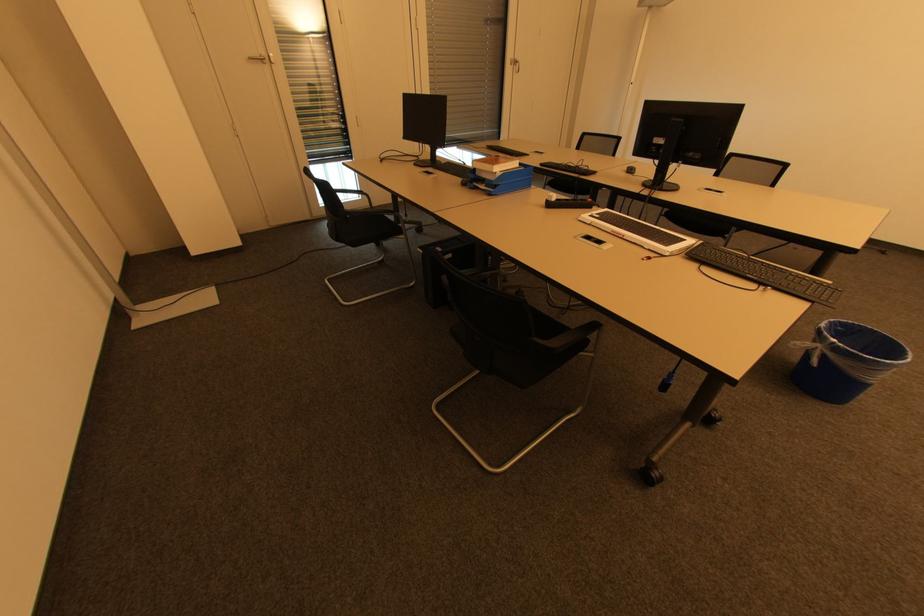
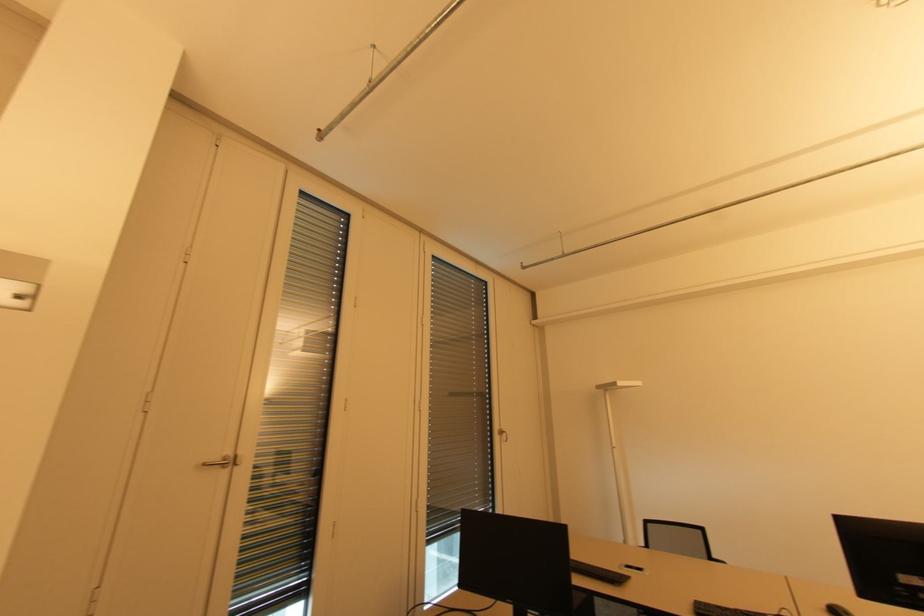
The point at (513, 65) is marked in the first image. Where is the corresponding point in the second image?

(501, 435)